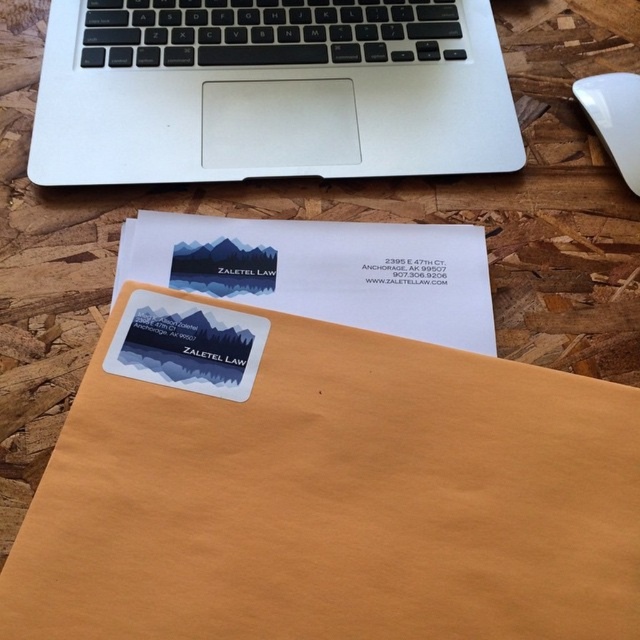
Question: Considering the relative positions of silver metallic laptop at upper center and white plastic mouse at upper right in the image provided, where is silver metallic laptop at upper center located with respect to white plastic mouse at upper right?

Choices:
 (A) right
 (B) left

Answer: (B)

Question: Which point appears closest to the camera in this image?

Choices:
 (A) (637, 76)
 (B) (118, 109)
 (C) (454, 433)
 (D) (289, 310)

Answer: (C)

Question: Estimate the real-world distances between objects in this image. Which object is farther from the brown paper envelope at center?

Choices:
 (A) white matte postcard at center
 (B) white plastic mouse at upper right
 (C) silver metallic laptop at upper center

Answer: (B)

Question: Is brown paper envelope at center smaller than white plastic mouse at upper right?

Choices:
 (A) no
 (B) yes

Answer: (A)

Question: Among these objects, which one is farthest from the camera?

Choices:
 (A) white plastic mouse at upper right
 (B) silver metallic laptop at upper center
 (C) white matte postcard at center

Answer: (A)

Question: Is silver metallic laptop at upper center thinner than white matte postcard at center?

Choices:
 (A) yes
 (B) no

Answer: (B)